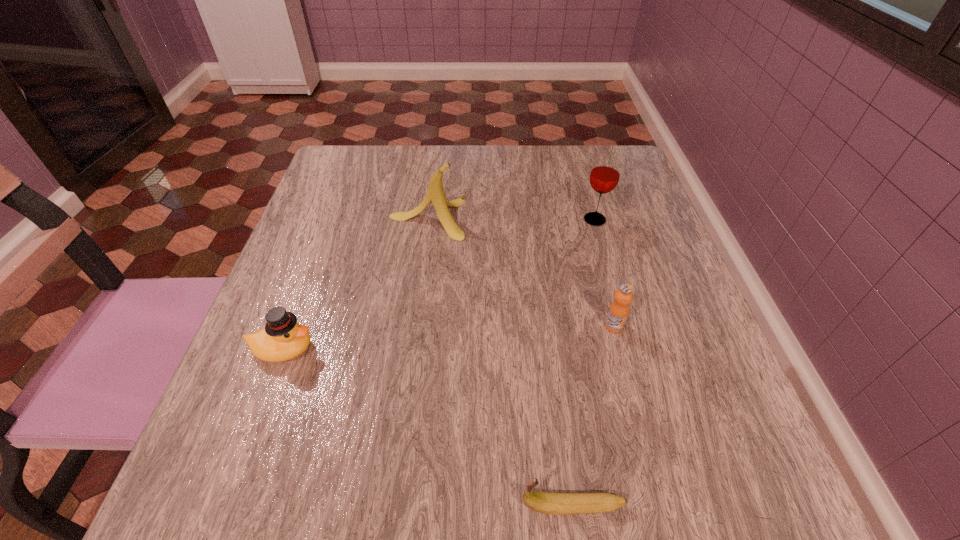
Locate an element on the screen. vacant area that lies between the farther banana and the nearer banana is located at coordinates (500, 362).

Where is `free spot between the nearest object and the farther banana`? The height and width of the screenshot is (540, 960). free spot between the nearest object and the farther banana is located at coordinates (500, 362).

Identify the location of unoccupied area between the shorter banana and the orange juice. This screenshot has width=960, height=540. (593, 416).

Identify the location of free area in between the orange juice and the farther banana. (520, 272).

At what (x,y) coordinates should I click in order to perform the action: click on empty location between the orange juice and the farther banana. Please return your answer as a coordinate pair (x, y). This screenshot has height=540, width=960. Looking at the image, I should click on (520, 272).

Locate an element on the screen. This screenshot has height=540, width=960. free space between the glass and the second object from left to right is located at coordinates (511, 219).

Identify the location of object that is the third closest to the orange juice. Image resolution: width=960 pixels, height=540 pixels. (435, 194).

Where is `object that is the second closest to the right banana`? This screenshot has width=960, height=540. object that is the second closest to the right banana is located at coordinates (283, 338).

This screenshot has width=960, height=540. Identify the location of vacant area in the image that satisfies the following two spatial constraints: 1. on the front side of the glass; 2. at the stem of the shorter banana. (677, 506).

Image resolution: width=960 pixels, height=540 pixels. What are the coordinates of `vacant point that satisfies the following two spatial constraints: 1. on the front side of the fourth object from right to left; 2. on the front-facing side of the duck` in the screenshot? It's located at (410, 349).